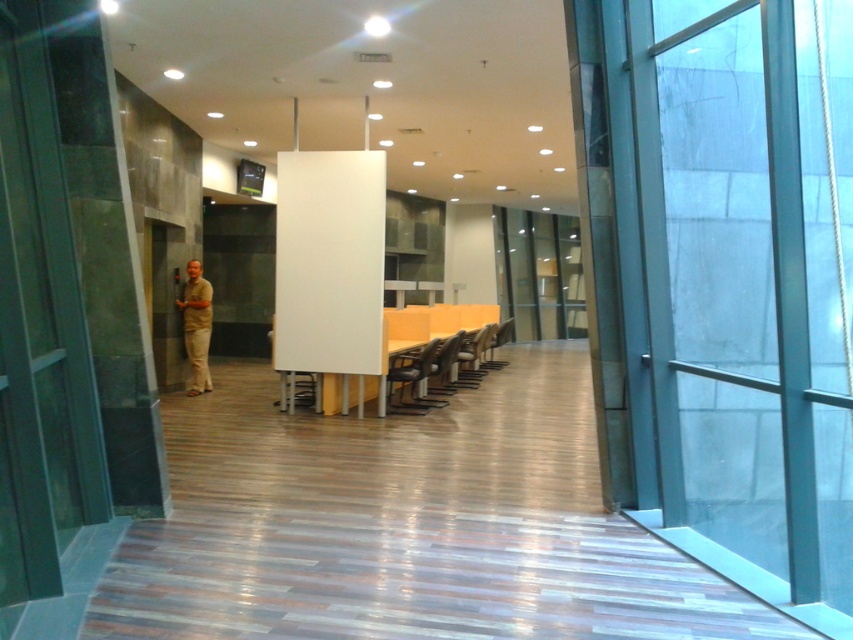
Is transparent glass door at right wider than matte gray chair at center?

Indeed, transparent glass door at right has a greater width compared to matte gray chair at center.

Locate an element on the screen. The height and width of the screenshot is (640, 853). transparent glass door at right is located at coordinates (746, 278).

Where is `transparent glass door at right`? The image size is (853, 640). transparent glass door at right is located at coordinates (746, 278).

Which is in front, point (369, 392) or point (460, 349)?

Point (369, 392) is more forward.

Between point (344, 390) and point (479, 352), which one is positioned behind?

The point (479, 352) is more distant.

What are the coordinates of `white glossy table at center` in the screenshot? It's located at (346, 392).

Can you confirm if beige fabric pants at left is positioned below matte plastic chair at center?

Actually, beige fabric pants at left is above matte plastic chair at center.

Looking at this image, who is more forward, (190, 355) or (415, 388)?

Positioned in front is point (415, 388).

Find the location of a particular element. This screenshot has width=853, height=640. beige fabric pants at left is located at coordinates (196, 326).